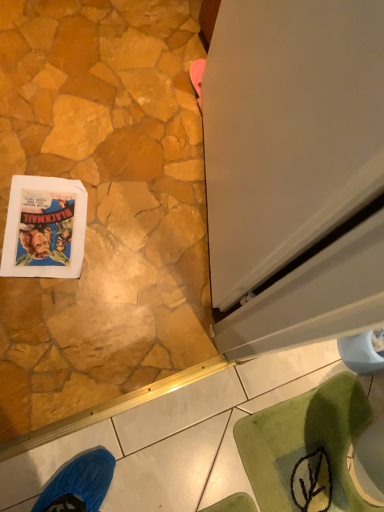
The width and height of the screenshot is (384, 512). What do you see at coordinates (294, 170) in the screenshot?
I see `white glossy screen door at right` at bounding box center [294, 170].

Identify the location of white glossy screen door at right. The image size is (384, 512). (294, 170).

What is the approximate height of white glossy screen door at right?

white glossy screen door at right is 35.63 inches tall.

The image size is (384, 512). I want to click on matte paper comic book at lower left, so click(x=44, y=228).

This screenshot has height=512, width=384. Describe the element at coordinates (44, 228) in the screenshot. I see `matte paper comic book at lower left` at that location.

This screenshot has height=512, width=384. I want to click on white glossy screen door at right, so click(294, 170).

Considering the positions of objects white glossy screen door at right and matte paper comic book at lower left in the image provided, who is more to the right, white glossy screen door at right or matte paper comic book at lower left?

white glossy screen door at right.

Based on the photo, considering the positions of objects white glossy screen door at right and matte paper comic book at lower left in the image provided, who is in front, white glossy screen door at right or matte paper comic book at lower left?

Positioned in front is white glossy screen door at right.

Is point (260, 141) behind point (49, 214)?

No, it is not.

From the image's perspective, is white glossy screen door at right on top of matte paper comic book at lower left?

Yes.

From a real-world perspective, between white glossy screen door at right and matte paper comic book at lower left, who is vertically lower?

matte paper comic book at lower left, from a real-world perspective.

In the scene shown: Considering the relative sizes of white glossy screen door at right and matte paper comic book at lower left in the image provided, is white glossy screen door at right wider than matte paper comic book at lower left?

In fact, white glossy screen door at right might be narrower than matte paper comic book at lower left.

Can you confirm if white glossy screen door at right is taller than matte paper comic book at lower left?

Yes, white glossy screen door at right is taller than matte paper comic book at lower left.

Based on their sizes in the image, would you say white glossy screen door at right is bigger or smaller than matte paper comic book at lower left?

In the image, white glossy screen door at right appears to be larger than matte paper comic book at lower left.

From the picture: Is white glossy screen door at right located outside matte paper comic book at lower left?

Indeed, white glossy screen door at right is completely outside matte paper comic book at lower left.

Is white glossy screen door at right far from matte paper comic book at lower left?

Actually, white glossy screen door at right and matte paper comic book at lower left are a little close together.

Looking at this image, is white glossy screen door at right looking in the opposite direction of matte paper comic book at lower left?

→ No.

Measure the distance between white glossy screen door at right and matte paper comic book at lower left.

22.36 inches.

The image size is (384, 512). In order to click on screen door above the matte paper comic book at lower left (from a real-world perspective) in this screenshot , I will do point(294,170).

Is matte paper comic book at lower left to the right of white glossy screen door at right from the viewer's perspective?

In fact, matte paper comic book at lower left is to the left of white glossy screen door at right.

Which object is more forward, matte paper comic book at lower left or white glossy screen door at right?

white glossy screen door at right is more forward.

Considering the positions of points (80, 245) and (268, 103), is point (80, 245) farther from camera compared to point (268, 103)?

Yes, point (80, 245) is farther from viewer.

From the image's perspective, is matte paper comic book at lower left on white glossy screen door at right?

No, from the image's perspective, matte paper comic book at lower left is not above white glossy screen door at right.

From a real-world perspective, relative to white glossy screen door at right, is matte paper comic book at lower left vertically above or below?

From a real-world perspective, matte paper comic book at lower left is physically below white glossy screen door at right.

Which of these two, matte paper comic book at lower left or white glossy screen door at right, is wider?

matte paper comic book at lower left is wider.

In terms of height, does matte paper comic book at lower left look taller or shorter compared to white glossy screen door at right?

In the image, matte paper comic book at lower left appears to be shorter than white glossy screen door at right.

Considering the relative sizes of matte paper comic book at lower left and white glossy screen door at right in the image provided, is matte paper comic book at lower left smaller than white glossy screen door at right?

Yes, matte paper comic book at lower left is smaller than white glossy screen door at right.

Is white glossy screen door at right surrounded by matte paper comic book at lower left?

No, white glossy screen door at right is not surrounded by matte paper comic book at lower left.

Looking at this image, is matte paper comic book at lower left far away from white glossy screen door at right?

That's not correct — matte paper comic book at lower left is a little close to white glossy screen door at right.

Could you tell me if matte paper comic book at lower left is turned towards white glossy screen door at right?

No, matte paper comic book at lower left is not facing towards white glossy screen door at right.

You are a GUI agent. You are given a task and a screenshot of the screen. Output one action in this format:
    pyautogui.click(x=<x>, y=<y>)
    Task: Click on the comic book below the white glossy screen door at right (from the image's perspective)
    This screenshot has width=384, height=512.
    Given the screenshot: What is the action you would take?
    pyautogui.click(x=44, y=228)

Locate an element on the screen. screen door located above the matte paper comic book at lower left (from the image's perspective) is located at coordinates (294, 170).

In the image, there is a white glossy screen door at right. Where is `comic book below it (from the image's perspective)`? comic book below it (from the image's perspective) is located at coordinates (44, 228).